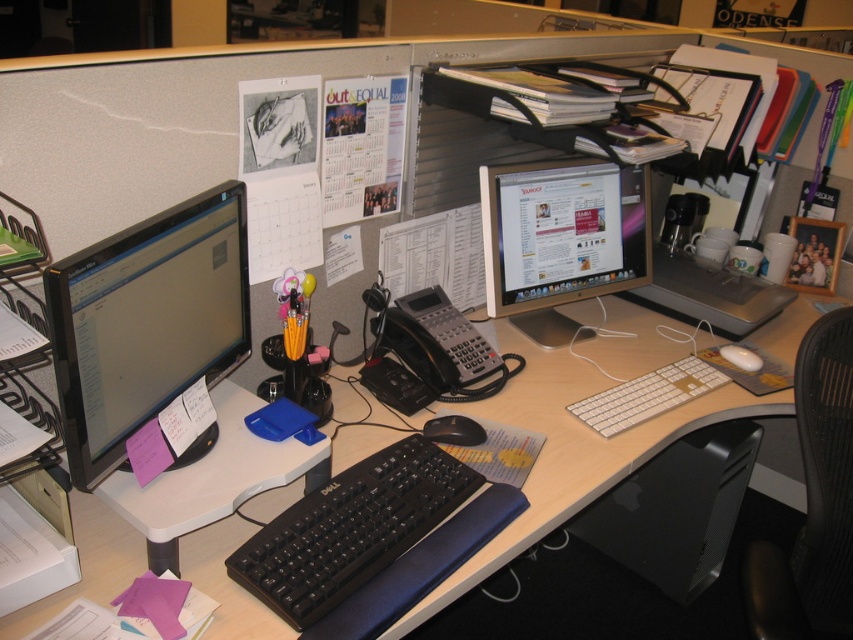
Question: Does white plastic keyboard at center have a larger size compared to white matte mouse at center?

Choices:
 (A) yes
 (B) no

Answer: (A)

Question: Can you confirm if black plastic computer desk at center is positioned below black matte mouse at center?

Choices:
 (A) no
 (B) yes

Answer: (A)

Question: Which point appears farthest from the camera in this image?

Choices:
 (A) (244, 413)
 (B) (717, 385)
 (C) (241, 260)

Answer: (B)

Question: Which of the following is the closest to the observer?

Choices:
 (A) (694, 387)
 (B) (740, 368)

Answer: (A)

Question: Which of the following is the farthest from the observer?

Choices:
 (A) white plastic keyboard at center
 (B) satin silver monitor at center
 (C) black matte mouse at center
 (D) matte black monitor at left

Answer: (B)

Question: Does black plastic computer desk at center have a lesser width compared to matte black monitor at left?

Choices:
 (A) no
 (B) yes

Answer: (A)